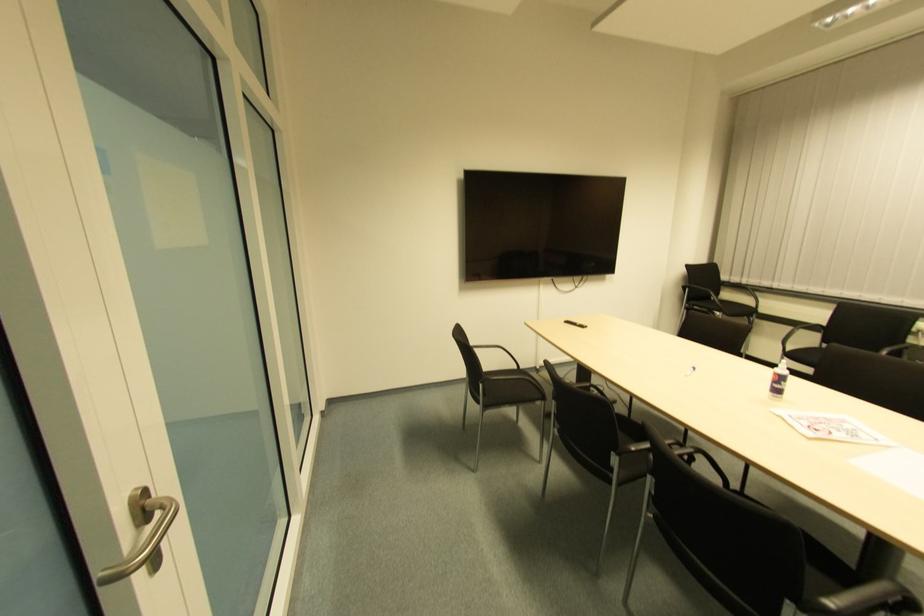
Where is `metal door handle`? This screenshot has height=616, width=924. metal door handle is located at coordinates (142, 535).